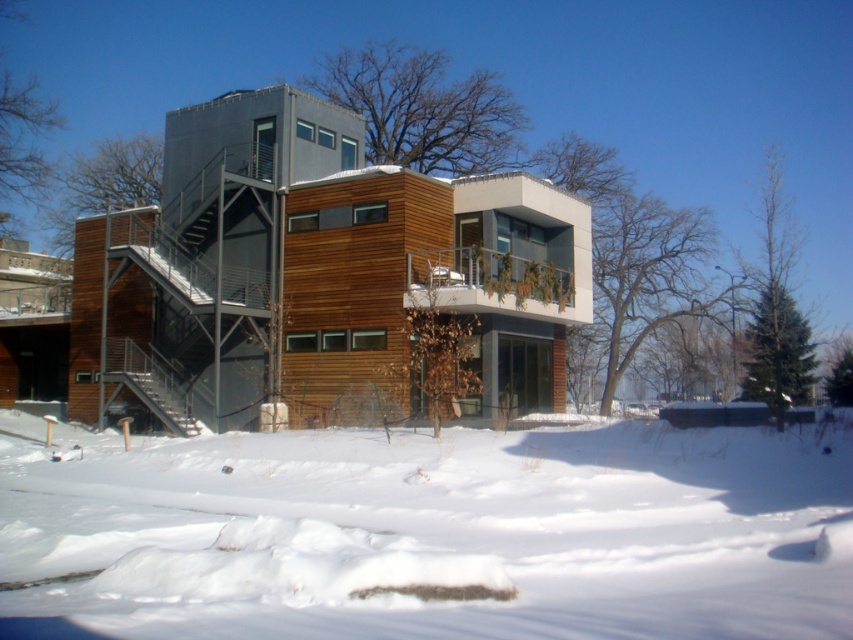
Can you confirm if white fluffy snow at lower center is bigger than metallic gray staircase at left?

Indeed, white fluffy snow at lower center has a larger size compared to metallic gray staircase at left.

Identify the location of white fluffy snow at lower center. This screenshot has width=853, height=640. (428, 532).

Which is in front, point (689, 557) or point (146, 356)?

Point (689, 557)

Locate an element on the screen. white fluffy snow at lower center is located at coordinates (428, 532).